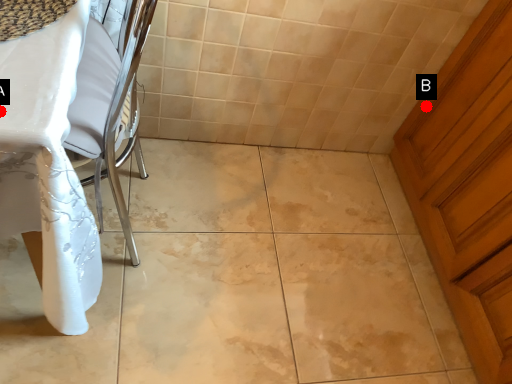
Question: Two points are circled on the image, labeled by A and B beside each circle. Which of the following is the farthest from the observer?

Choices:
 (A) A is further
 (B) B is further

Answer: (B)